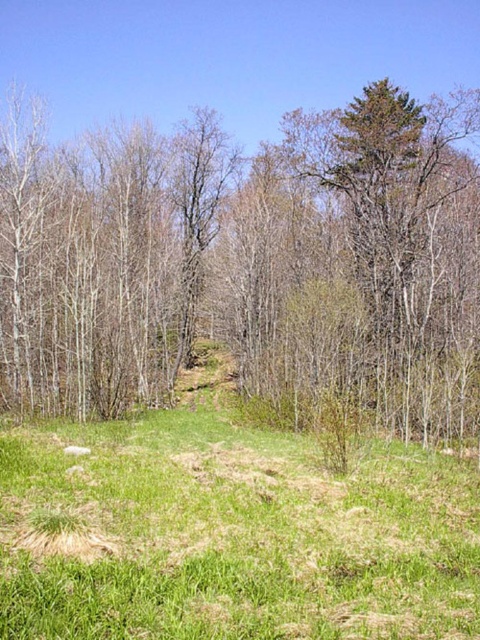
You are a hiker standing at the edge of the green grass at lower center, planning to walk towards the brown bark tree at center. Based on the scene, can you estimate whether the tree will be taller than the grass when you arrive?

The brown bark tree at center has a greater height compared to the green grass at lower center, so yes, the tree will be taller than the grass when you arrive.

You are a hiker trying to walk along the path in the image. You notice the green grass at lower center and the brown bark tree at center. Which object is closer to you as you stand on the path?

The brown bark tree at center is closer to you because the green grass at lower center is behind it.